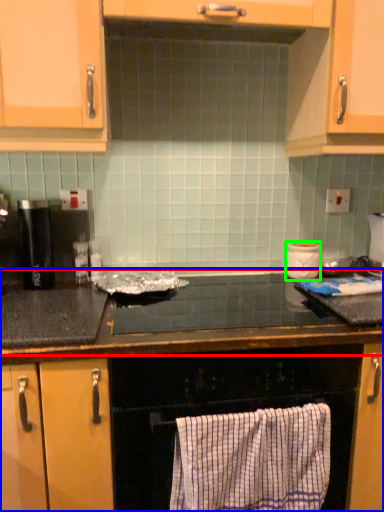
Question: Estimate the real-world distances between objects in this image. Which object is closer to countertop (highlighted by a red box), countertop (highlighted by a blue box) or appliance (highlighted by a green box)?

Choices:
 (A) countertop
 (B) appliance

Answer: (A)